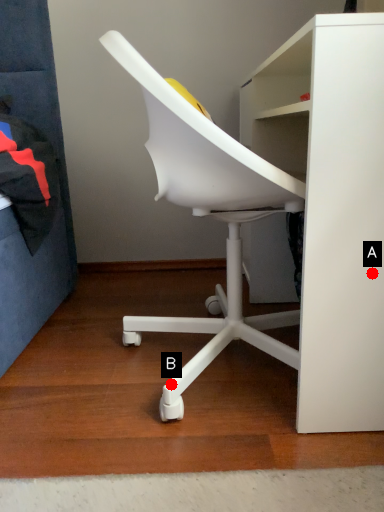
Question: Two points are circled on the image, labeled by A and B beside each circle. Which point is farther to the camera?

Choices:
 (A) A is further
 (B) B is further

Answer: (B)